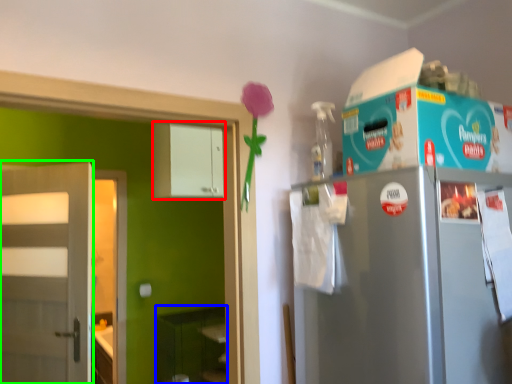
Question: Which object is positioned closest to cabinetry (highlighted by a red box)? Select from shelf (highlighted by a blue box) and door (highlighted by a green box).

Choices:
 (A) shelf
 (B) door

Answer: (B)